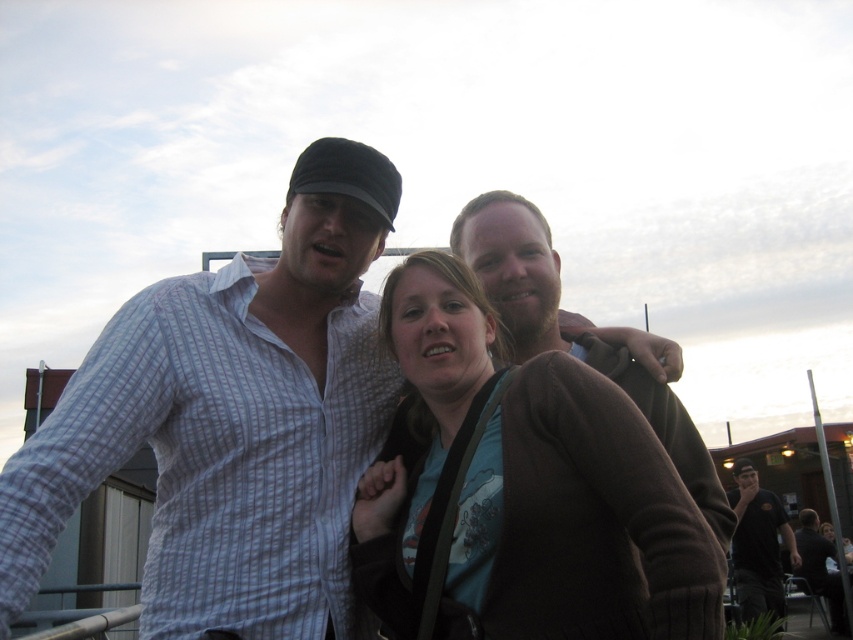
Is brown soft sweater at center positioned in front of black cotton shirt at lower right?

Yes, it is.

Does brown soft sweater at center have a smaller size compared to black cotton shirt at lower right?

Indeed, brown soft sweater at center has a smaller size compared to black cotton shirt at lower right.

Between point (492, 566) and point (764, 589), which one is positioned in front?

Point (492, 566)

The width and height of the screenshot is (853, 640). I want to click on brown soft sweater at center, so click(x=527, y=490).